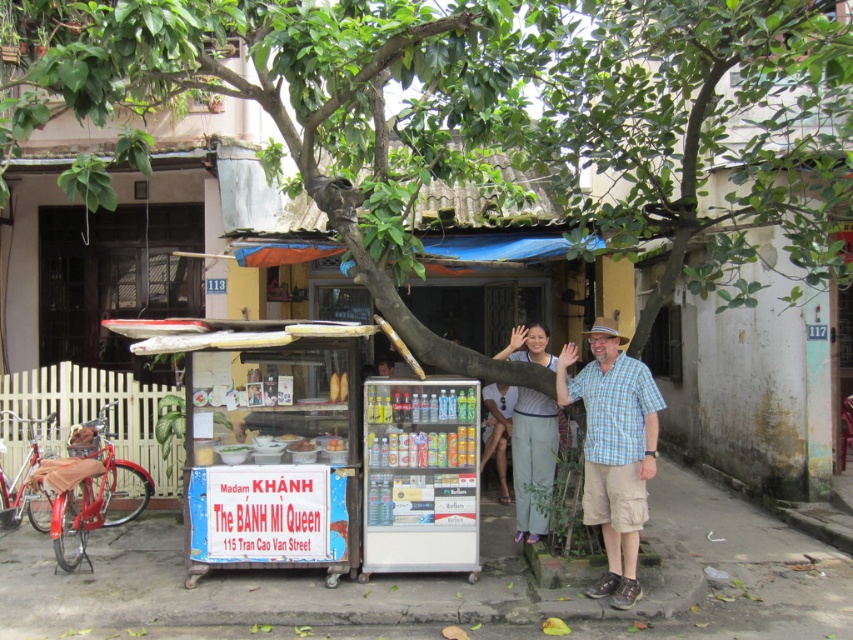
Question: Does plaid cotton shirt at center appear on the right side of light blue cotton pants at center?

Choices:
 (A) no
 (B) yes

Answer: (B)

Question: Which of the following is the closest to the observer?

Choices:
 (A) (558, 404)
 (B) (546, 484)

Answer: (A)

Question: Is plaid cotton shirt at center above light blue cotton pants at center?

Choices:
 (A) no
 (B) yes

Answer: (A)

Question: Which of the following is the farthest from the observer?

Choices:
 (A) light blue cotton pants at center
 (B) plaid cotton shirt at center

Answer: (A)

Question: Is plaid cotton shirt at center wider than light blue cotton pants at center?

Choices:
 (A) yes
 (B) no

Answer: (A)